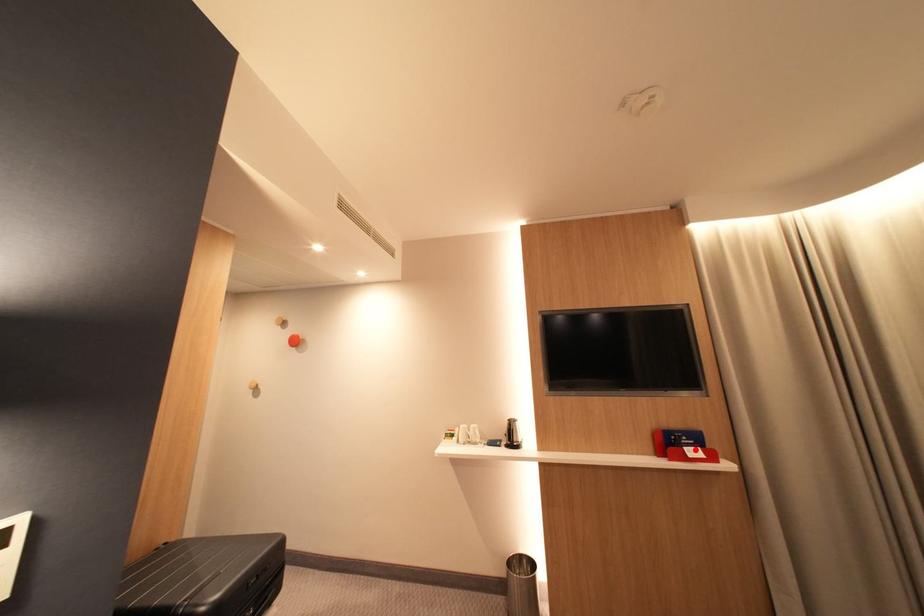
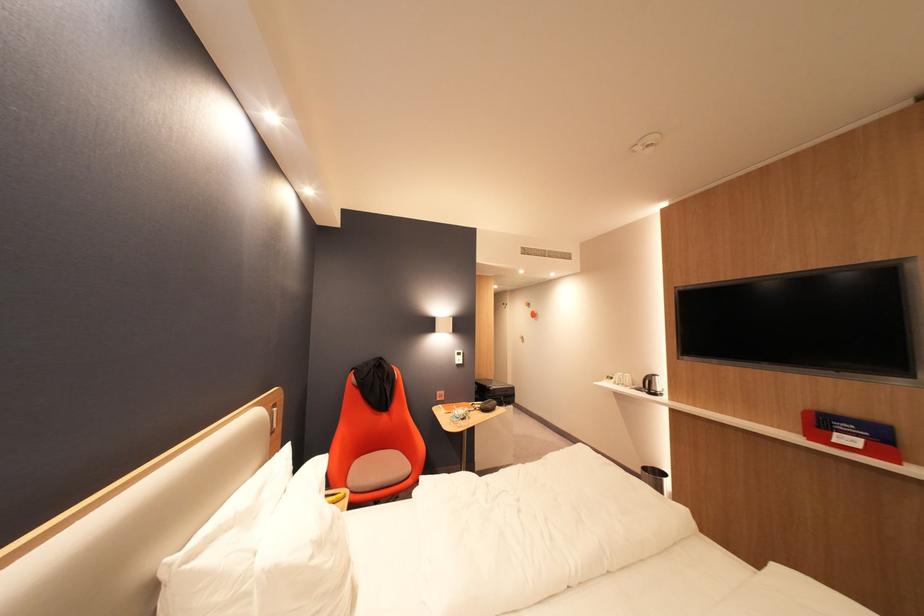
Question: A red point is marked in image1. In image2, is the corresponding 3D point closer to the camera or farther? Reply with the corresponding letter.

Choices:
 (A) The corresponding 3D point is closer.
 (B) The corresponding 3D point is farther.

Answer: (A)